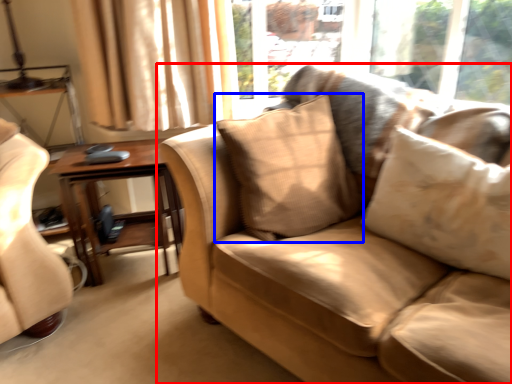
Question: Which object is further to the camera taking this photo, studio couch (highlighted by a red box) or pillow (highlighted by a blue box)?

Choices:
 (A) studio couch
 (B) pillow

Answer: (B)